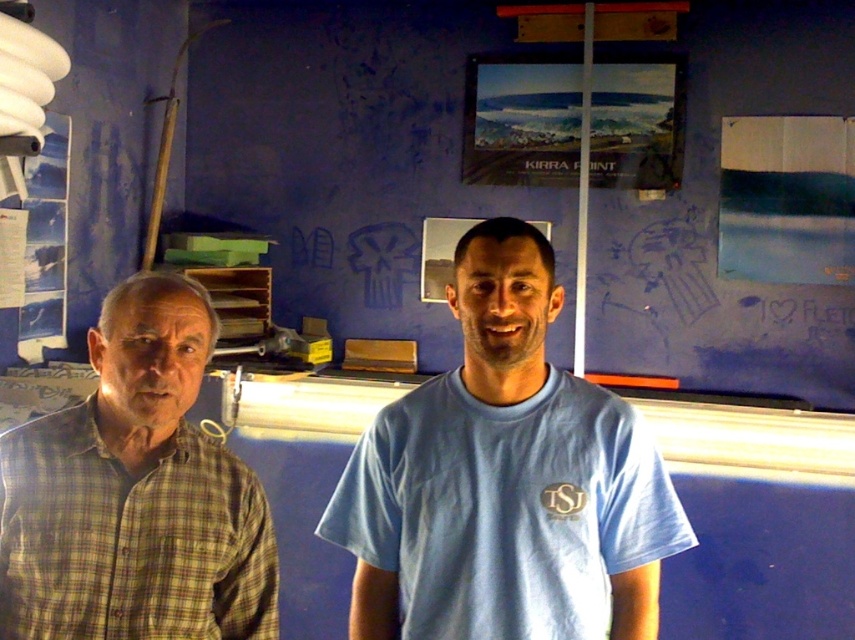
Question: Is blue matte bulletin board at upper center wider than yellow-green plaid shirt at left?

Choices:
 (A) yes
 (B) no

Answer: (A)

Question: Which of the following is the farthest from the observer?

Choices:
 (A) (104, 388)
 (B) (195, 189)
 (C) (414, 589)

Answer: (B)

Question: Which of these objects is positioned closest to the light blue t-shirt at center?

Choices:
 (A) blue matte bulletin board at upper center
 (B) yellow-green plaid shirt at left

Answer: (B)

Question: Is light blue t-shirt at center smaller than yellow-green plaid shirt at left?

Choices:
 (A) yes
 (B) no

Answer: (B)

Question: Does light blue t-shirt at center have a larger size compared to yellow-green plaid shirt at left?

Choices:
 (A) no
 (B) yes

Answer: (B)

Question: Which object is farther from the camera taking this photo?

Choices:
 (A) light blue t-shirt at center
 (B) yellow-green plaid shirt at left
 (C) blue matte bulletin board at upper center

Answer: (C)